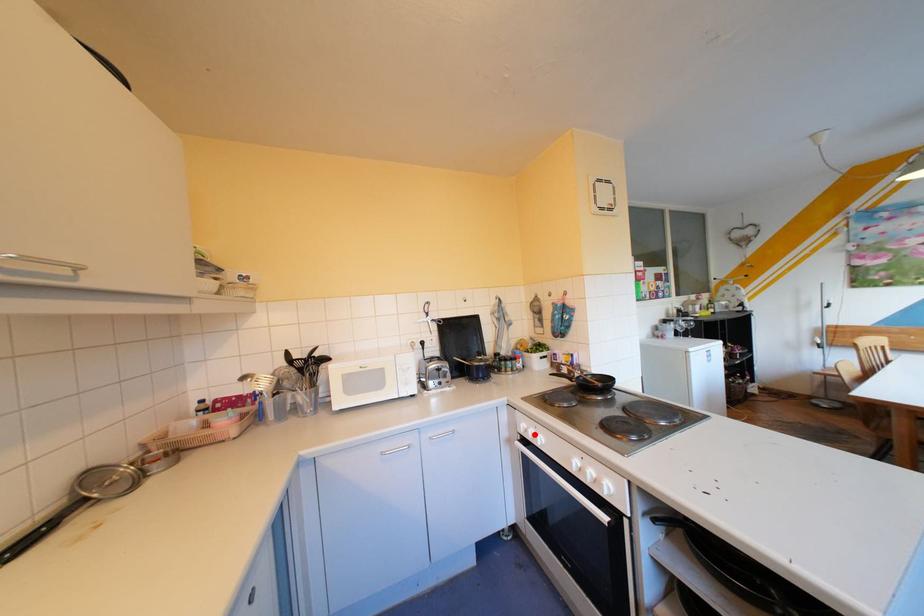
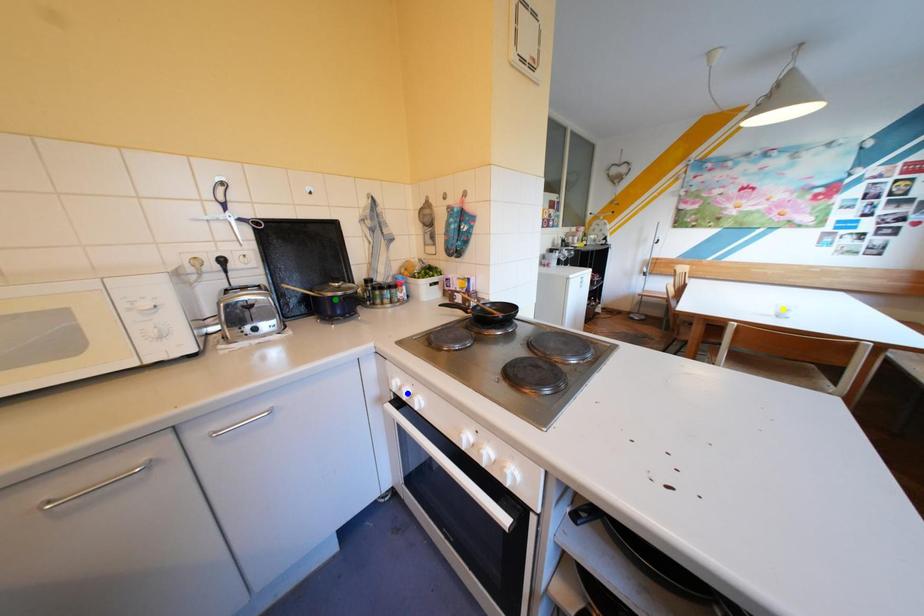
Question: I am providing you with two images of the same scene from different viewpoints. A red point is marked on the first image. You are given multiple points on the second image. Which mark in image 2 goes with the point in image 1?

Choices:
 (A) yellow point
 (B) green point
 (C) blue point

Answer: (C)